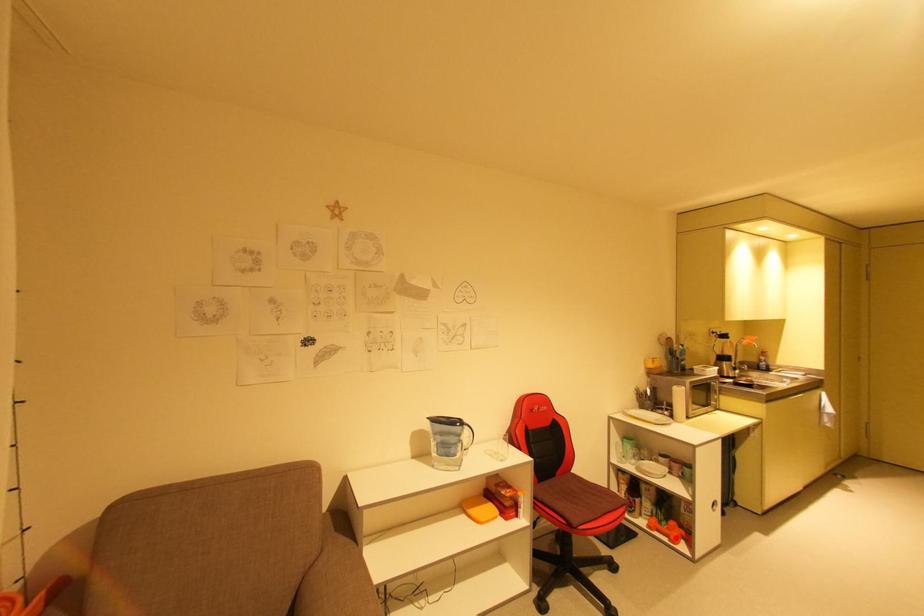
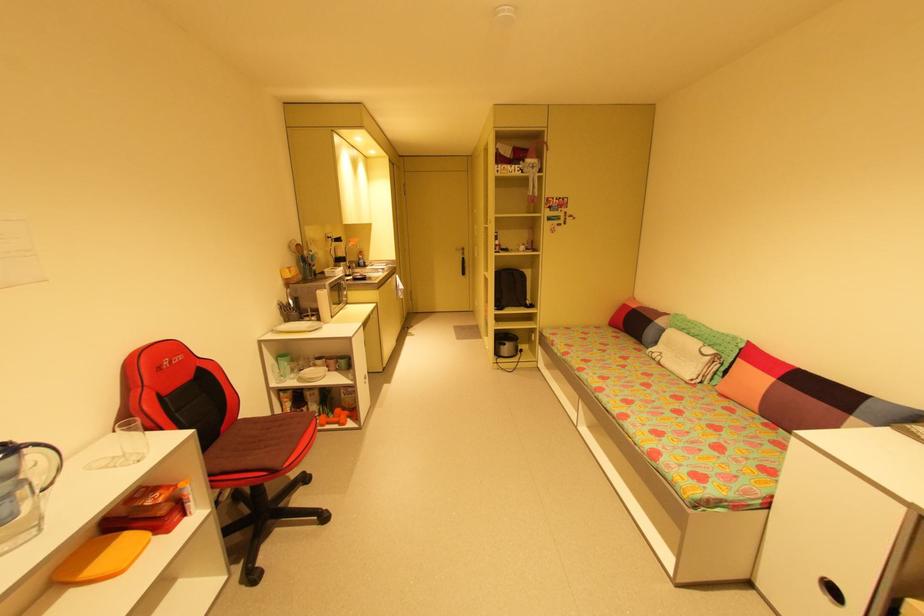
Question: A red point is marked in image1. In image2, is the corresponding 3D point closer to the camera or farther? Reply with the corresponding letter.

Choices:
 (A) The corresponding 3D point is closer.
 (B) The corresponding 3D point is farther.

Answer: (A)